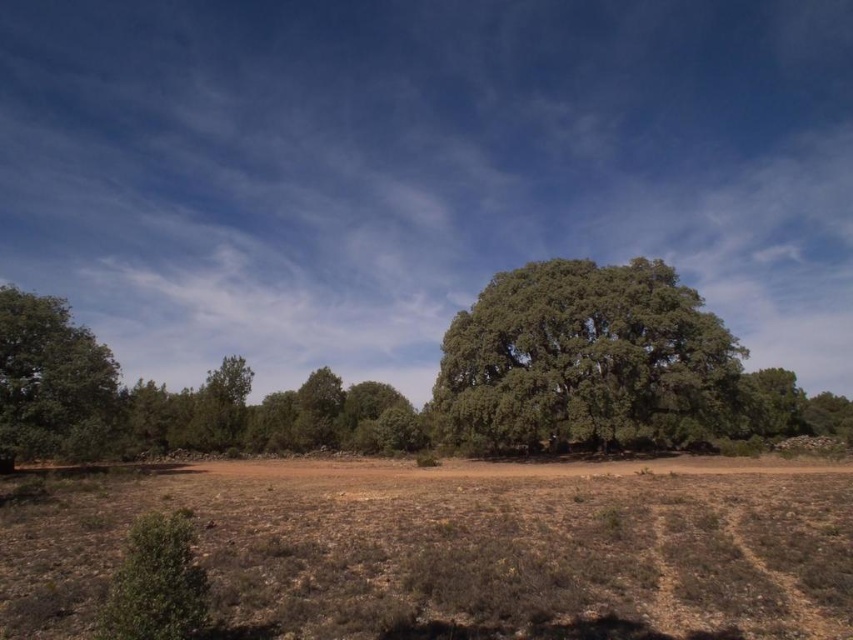
Who is more distant from viewer, (596, 394) or (102, 371)?

The point (596, 394) is behind.

Between green leafy tree at center and green leafy tree at left, which one is positioned higher?

Positioned higher is green leafy tree at left.

What do you see at coordinates (584, 360) in the screenshot? The width and height of the screenshot is (853, 640). I see `green leafy tree at center` at bounding box center [584, 360].

Image resolution: width=853 pixels, height=640 pixels. Find the location of `green leafy tree at center`. green leafy tree at center is located at coordinates (584, 360).

Is point (451, 554) in front of point (730, 406)?

Yes, it is.

Looking at this image, which of these two, brown dry grass at lower center or green leafy tree at center, stands taller?

Standing taller between the two is green leafy tree at center.

Locate an element on the screen. The width and height of the screenshot is (853, 640). brown dry grass at lower center is located at coordinates (457, 548).

Between brown dry grass at lower center and green leafy tree at left, which one appears on the left side from the viewer's perspective?

green leafy tree at left

Can you confirm if brown dry grass at lower center is positioned to the right of green leafy tree at left?

Indeed, brown dry grass at lower center is positioned on the right side of green leafy tree at left.

Is point (325, 515) positioned after point (67, 435)?

No, it is in front of (67, 435).

Where is `brown dry grass at lower center`? brown dry grass at lower center is located at coordinates (457, 548).